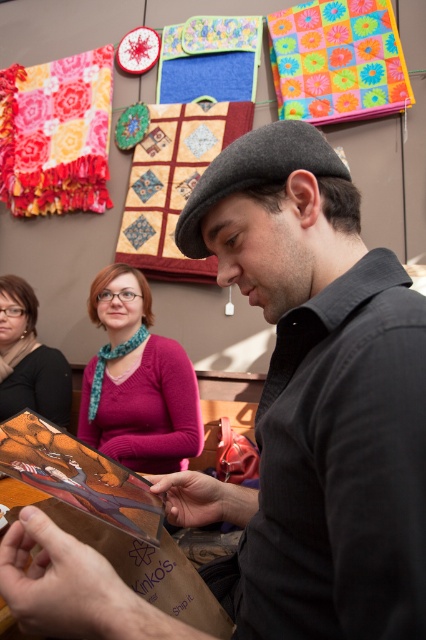
You are standing in the room and want to determine which of the two points, point (143,374) or point (290,145), is closer to you. Based on the scene description, which point is nearer?

Point (143,374) is further to the viewer than point (290,145). Wait, no, the description says the opposite. Let me check again. The Objects Description states that point (143,374) is further to the viewer than point (290,145). Therefore, the closer point to you would be point (290,145) because it is less further away. Hmm, maybe I need to rephrase. Since point A is further than point B, then point B is closer. So the answer should be point (290,145) is closer.

What is the exact coordinate of the quilted fabric at center?

The quilted fabric at center is located at point (173,182).